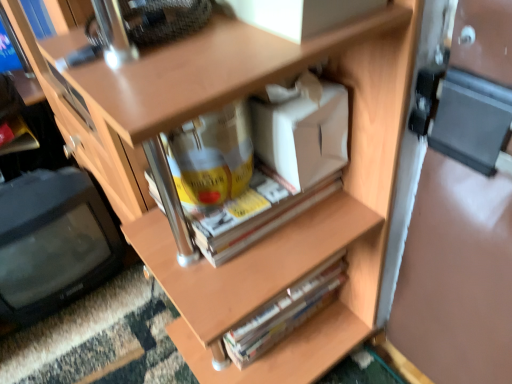
Question: Is black plastic computer monitor at left aimed at white cardboard box at center?

Choices:
 (A) yes
 (B) no

Answer: (B)

Question: Considering the relative sizes of black plastic computer monitor at left and white cardboard box at center in the image provided, is black plastic computer monitor at left shorter than white cardboard box at center?

Choices:
 (A) yes
 (B) no

Answer: (B)

Question: Can you confirm if black plastic computer monitor at left is bigger than white cardboard box at center?

Choices:
 (A) no
 (B) yes

Answer: (B)

Question: Can you confirm if black plastic computer monitor at left is taller than white cardboard box at center?

Choices:
 (A) yes
 (B) no

Answer: (A)

Question: Is black plastic computer monitor at left outside of white cardboard box at center?

Choices:
 (A) yes
 (B) no

Answer: (A)

Question: Considering their positions, is black plastic computer monitor at left located in front of or behind hardcover book at center?

Choices:
 (A) behind
 (B) front

Answer: (A)

Question: Is black plastic computer monitor at left taller or shorter than hardcover book at center?

Choices:
 (A) tall
 (B) short

Answer: (A)

Question: Is black plastic computer monitor at left bigger or smaller than hardcover book at center?

Choices:
 (A) big
 (B) small

Answer: (A)

Question: Is black plastic computer monitor at left inside the boundaries of hardcover book at center, or outside?

Choices:
 (A) inside
 (B) outside

Answer: (B)

Question: In terms of size, does hardcover book at center appear bigger or smaller than white cardboard box at center?

Choices:
 (A) small
 (B) big

Answer: (B)

Question: From a real-world perspective, is hardcover book at center physically located above or below white cardboard box at center?

Choices:
 (A) below
 (B) above

Answer: (A)

Question: From the image's perspective, is hardcover book at center located above or below white cardboard box at center?

Choices:
 (A) above
 (B) below

Answer: (B)

Question: Is hardcover book at center taller or shorter than white cardboard box at center?

Choices:
 (A) short
 (B) tall

Answer: (B)

Question: Considering the positions of white cardboard box at center and hardcover book at center in the image, is white cardboard box at center wider or thinner than hardcover book at center?

Choices:
 (A) wide
 (B) thin

Answer: (B)

Question: Considering the positions of point click(284, 89) and point click(334, 266), is point click(284, 89) closer or farther from the camera than point click(334, 266)?

Choices:
 (A) farther
 (B) closer

Answer: (B)